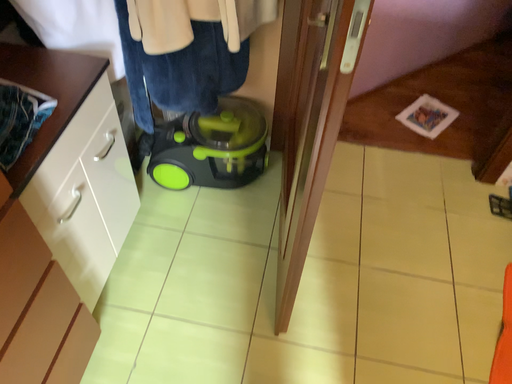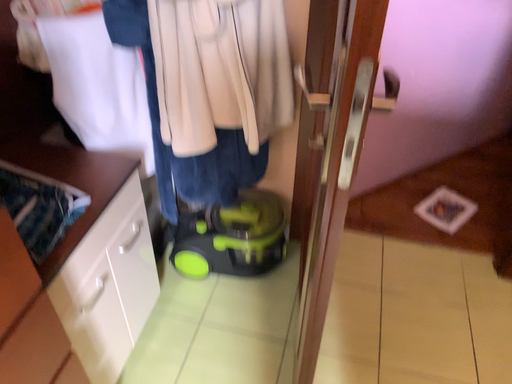
Question: How did the camera likely rotate when shooting the video?

Choices:
 (A) rotated upward
 (B) rotated downward

Answer: (A)